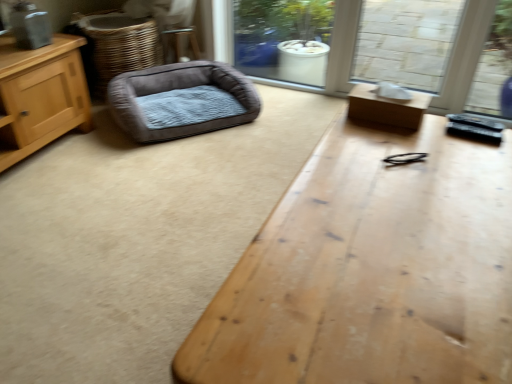
What do you see at coordinates (371, 270) in the screenshot?
I see `wooden table at center, the 1th table when ordered from bottom to top` at bounding box center [371, 270].

Measure the distance between wooden table at center, the 1th table when ordered from bottom to top, and camera.

A distance of 25.80 inches exists between wooden table at center, the 1th table when ordered from bottom to top, and camera.

What are the coordinates of `wooden table at center, the 1th table when ordered from bottom to top` in the screenshot? It's located at (371, 270).

Is velvet-like brown dog bed at left outside of brown woven basket at left?

Yes.

Consider the image. Is velvet-like brown dog bed at left shorter than brown woven basket at left?

Yes.

Which is more to the right, velvet-like brown dog bed at left or brown woven basket at left?

velvet-like brown dog bed at left is more to the right.

This screenshot has width=512, height=384. I want to click on basket located above the velvet-like brown dog bed at left (from the image's perspective), so click(x=117, y=46).

Consider the image. Is brown woven basket at left beside wooden table at center, the 1th table when ordered from bottom to top?

They are not placed beside each other.

Consider the image. Can you tell me how much brown woven basket at left and wooden table at center, which is the 2th table in top-to-bottom order, differ in facing direction?

They differ by 149 degrees in their facing directions.

From a real-world perspective, is brown woven basket at left above or below wooden table at center, the 1th table when ordered from bottom to top?

In terms of real-world spatial position, brown woven basket at left is below wooden table at center, the 1th table when ordered from bottom to top.

Is brown woven basket at left positioned with its back to wooden table at center, the 1th table when ordered from bottom to top?

No, wooden table at center, the 1th table when ordered from bottom to top, is not at the back of brown woven basket at left.

From the image's perspective, would you say velvet-like brown dog bed at left is shown under brown cardboard box at right, marked as the 1th table in a top-to-bottom arrangement?

No, from the image's perspective, velvet-like brown dog bed at left is not below brown cardboard box at right, marked as the 1th table in a top-to-bottom arrangement.

At what (x,y) coordinates should I click in order to perform the action: click on dog bed below the brown cardboard box at right, marked as the 1th table in a top-to-bottom arrangement (from a real-world perspective). Please return your answer as a coordinate pair (x, y). Image resolution: width=512 pixels, height=384 pixels. Looking at the image, I should click on (181, 100).

Is velvet-like brown dog bed at left turned away from brown cardboard box at right, marked as the 1th table in a top-to-bottom arrangement?

No, velvet-like brown dog bed at left is not facing away from brown cardboard box at right, marked as the 1th table in a top-to-bottom arrangement.

From a real-world perspective, is velvet-like brown dog bed at left located beneath brown cardboard box at right, positioned as the second table in bottom-to-top order?

Indeed, from a real-world perspective, velvet-like brown dog bed at left is positioned beneath brown cardboard box at right, positioned as the second table in bottom-to-top order.

Is wooden table at center, the 1th table when ordered from bottom to top, not close to velvet-like brown dog bed at left?

Yes, wooden table at center, the 1th table when ordered from bottom to top, and velvet-like brown dog bed at left are located far from each other.

From the image's perspective, would you say wooden table at center, which is the 2th table in top-to-bottom order, is shown under velvet-like brown dog bed at left?

Indeed, from the image's perspective, wooden table at center, which is the 2th table in top-to-bottom order, is shown beneath velvet-like brown dog bed at left.

Looking at this image, is wooden table at center, which is the 2th table in top-to-bottom order, behind velvet-like brown dog bed at left?

No, it is not.

From a real-world perspective, between wooden table at center, the 1th table when ordered from bottom to top, and velvet-like brown dog bed at left, who is vertically higher?

In real-world perspective, wooden table at center, the 1th table when ordered from bottom to top, is above.

From a real-world perspective, is wooden table at center, which is the 2th table in top-to-bottom order, located beneath brown cardboard box at right, marked as the 1th table in a top-to-bottom arrangement?

Yes.

Is wooden table at center, which is the 2th table in top-to-bottom order, positioned behind brown cardboard box at right, positioned as the second table in bottom-to-top order?

No, wooden table at center, which is the 2th table in top-to-bottom order, is closer to the camera.

What are the coordinates of `table behind the wooden table at center, the 1th table when ordered from bottom to top` in the screenshot? It's located at (387, 107).

Does point (433, 189) come behind point (389, 120)?

That is False.

Looking at this image, considering their positions, is brown cardboard box at right, positioned as the second table in bottom-to-top order, located in front of or behind wooden table at center, which is the 2th table in top-to-bottom order?

brown cardboard box at right, positioned as the second table in bottom-to-top order, is positioned farther from the viewer than wooden table at center, which is the 2th table in top-to-bottom order.

From the image's perspective, is brown cardboard box at right, positioned as the second table in bottom-to-top order, over wooden table at center, the 1th table when ordered from bottom to top?

Indeed, from the image's perspective, brown cardboard box at right, positioned as the second table in bottom-to-top order, is shown above wooden table at center, the 1th table when ordered from bottom to top.

Consider the image. Could you measure the distance between brown cardboard box at right, marked as the 1th table in a top-to-bottom arrangement, and wooden table at center, the 1th table when ordered from bottom to top?

16.15 inches.

Is wooden table at center, the 1th table when ordered from bottom to top, surrounded by brown cardboard box at right, positioned as the second table in bottom-to-top order?

No, wooden table at center, the 1th table when ordered from bottom to top, is not surrounded by brown cardboard box at right, positioned as the second table in bottom-to-top order.

What's the angular difference between velvet-like brown dog bed at left and wooden table at center, which is the 2th table in top-to-bottom order,'s facing directions?

The angle between the facing direction of velvet-like brown dog bed at left and the facing direction of wooden table at center, which is the 2th table in top-to-bottom order, is 143 degrees.

From the image's perspective, would you say velvet-like brown dog bed at left is positioned over wooden table at center, the 1th table when ordered from bottom to top?

Yes.

Consider the image. Is velvet-like brown dog bed at left thinner than wooden table at center, the 1th table when ordered from bottom to top?

Yes.

Considering the sizes of objects velvet-like brown dog bed at left and wooden table at center, the 1th table when ordered from bottom to top, in the image provided, who is taller, velvet-like brown dog bed at left or wooden table at center, the 1th table when ordered from bottom to top,?

Standing taller between the two is wooden table at center, the 1th table when ordered from bottom to top.

This screenshot has height=384, width=512. What are the coordinates of `basket above the velvet-like brown dog bed at left (from the image's perspective)` in the screenshot? It's located at (117, 46).

From a real-world perspective, which table is the 1st one above the brown woven basket at left? Please provide its 2D coordinates.

[(371, 270)]

Based on their spatial positions, is brown woven basket at left or brown cardboard box at right, marked as the 1th table in a top-to-bottom arrangement, further from velvet-like brown dog bed at left?

brown cardboard box at right, marked as the 1th table in a top-to-bottom arrangement, lies further to velvet-like brown dog bed at left than the other object.

Based on their spatial positions, is wooden table at center, which is the 2th table in top-to-bottom order, or brown woven basket at left further from brown cardboard box at right, marked as the 1th table in a top-to-bottom arrangement?

Among the two, brown woven basket at left is located further to brown cardboard box at right, marked as the 1th table in a top-to-bottom arrangement.

When comparing their distances from brown cardboard box at right, positioned as the second table in bottom-to-top order, does velvet-like brown dog bed at left or wooden table at center, the 1th table when ordered from bottom to top, seem closer?

Among the two, wooden table at center, the 1th table when ordered from bottom to top, is located nearer to brown cardboard box at right, positioned as the second table in bottom-to-top order.

Which object lies further to the anchor point wooden table at center, which is the 2th table in top-to-bottom order, brown woven basket at left or brown cardboard box at right, positioned as the second table in bottom-to-top order?

The object further to wooden table at center, which is the 2th table in top-to-bottom order, is brown woven basket at left.

Looking at the image, which one is located closer to brown cardboard box at right, marked as the 1th table in a top-to-bottom arrangement, brown woven basket at left or velvet-like brown dog bed at left?

Based on the image, velvet-like brown dog bed at left appears to be nearer to brown cardboard box at right, marked as the 1th table in a top-to-bottom arrangement.

When comparing their distances from brown cardboard box at right, positioned as the second table in bottom-to-top order, does brown woven basket at left or wooden table at center, the 1th table when ordered from bottom to top, seem further?

Among the two, brown woven basket at left is located further to brown cardboard box at right, positioned as the second table in bottom-to-top order.

In the scene shown: Which object lies nearer to the anchor point velvet-like brown dog bed at left, brown cardboard box at right, marked as the 1th table in a top-to-bottom arrangement, or brown woven basket at left?

Among the two, brown woven basket at left is located nearer to velvet-like brown dog bed at left.

Looking at the image, which one is located closer to brown woven basket at left, wooden table at center, which is the 2th table in top-to-bottom order, or velvet-like brown dog bed at left?

velvet-like brown dog bed at left is positioned closer to the anchor brown woven basket at left.

The image size is (512, 384). In order to click on table between wooden table at center, which is the 2th table in top-to-bottom order, and velvet-like brown dog bed at left in the front-back direction in this screenshot , I will do `click(387, 107)`.

Where is `dog bed located between brown woven basket at left and brown cardboard box at right, positioned as the second table in bottom-to-top order, in the left-right direction`? Image resolution: width=512 pixels, height=384 pixels. dog bed located between brown woven basket at left and brown cardboard box at right, positioned as the second table in bottom-to-top order, in the left-right direction is located at coordinates pyautogui.click(x=181, y=100).

You are a GUI agent. You are given a task and a screenshot of the screen. Output one action in this format:
    pyautogui.click(x=<x>, y=<y>)
    Task: Click on the dog bed between wooden table at center, the 1th table when ordered from bottom to top, and brown woven basket at left, along the z-axis
    This screenshot has width=512, height=384.
    Given the screenshot: What is the action you would take?
    pyautogui.click(x=181, y=100)

The height and width of the screenshot is (384, 512). Find the location of `table located between wooden table at center, the 1th table when ordered from bottom to top, and brown woven basket at left in the depth direction`. table located between wooden table at center, the 1th table when ordered from bottom to top, and brown woven basket at left in the depth direction is located at coordinates (387, 107).